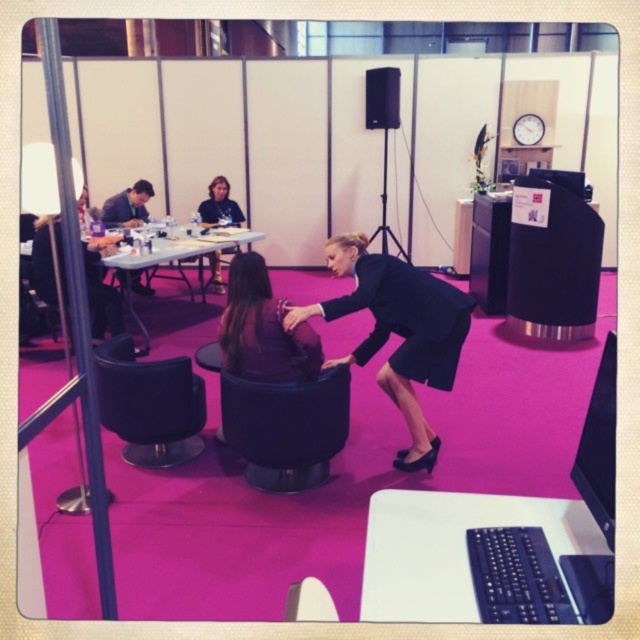
You are a guest entering the room and need to choose a seat between the black leather armchair at center and the dark blue fabric chair at center. Which one is positioned lower to the ground?

The black leather armchair at center is located below the dark blue fabric chair at center, so it is positioned lower to the ground.

You are standing in the conference room and need to place a document on the white plastic round table at center. Based on its position, where should you walk to reach it?

The white plastic round table at center is located at coordinates point (451, 547), so you should walk towards the center area of the room to reach it.